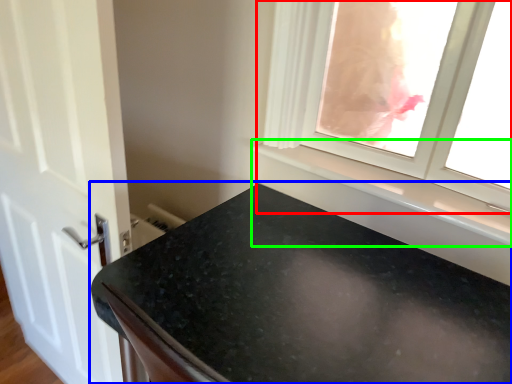
Question: Based on their relative distances, which object is farther from window (highlighted by a red box)? Choose from countertop (highlighted by a blue box) and window sill (highlighted by a green box).

Choices:
 (A) countertop
 (B) window sill

Answer: (A)